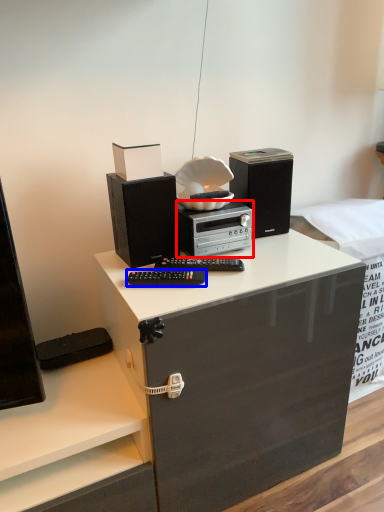
Question: Which of the following is the farthest to the observer, home appliance (highlighted by a red box) or equipment (highlighted by a blue box)?

Choices:
 (A) home appliance
 (B) equipment

Answer: (A)